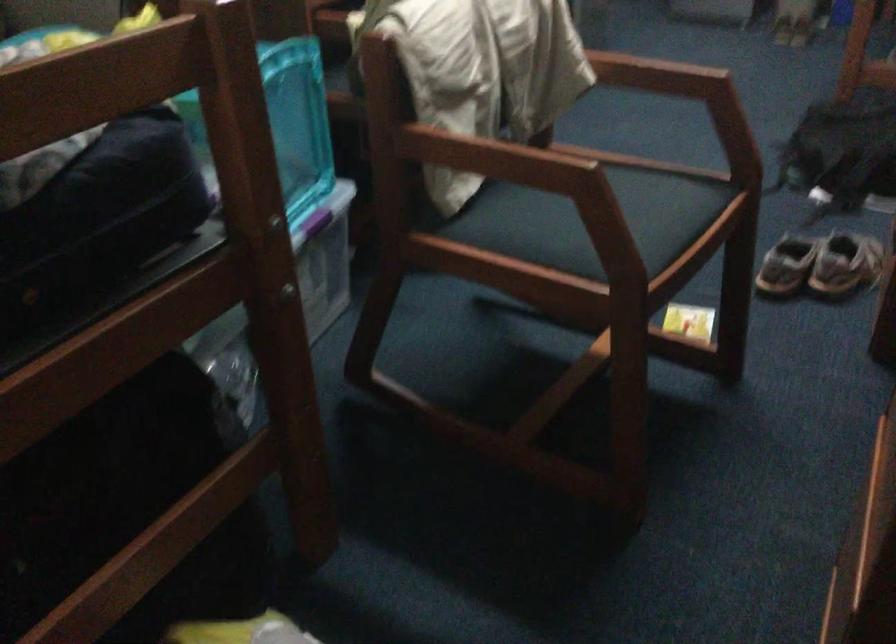
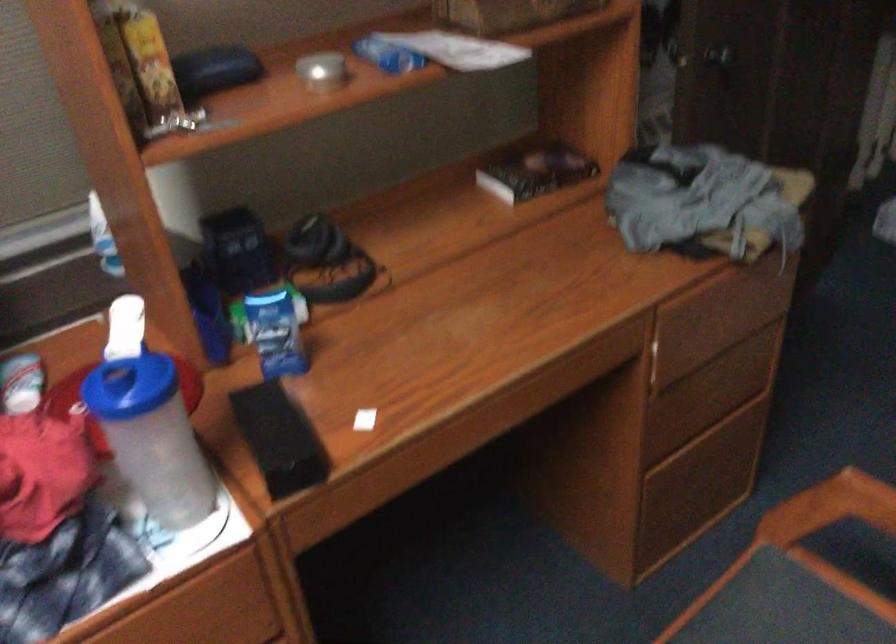
Locate, in the second image, the point that corresponds to pixel 657 236 in the first image.

(830, 507)